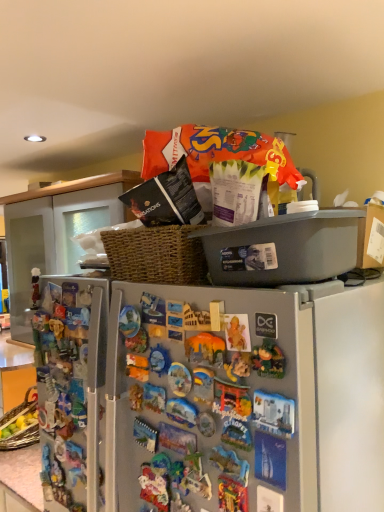
Identify the location of metallic gray refrigerator at center. The width and height of the screenshot is (384, 512). (245, 399).

This screenshot has height=512, width=384. I want to click on metallic gray refrigerator at center, so click(x=245, y=399).

From the image's perspective, would you say matte orange toy at center, which is the 2th toy in back-to-front order, is positioned over metallic gray refrigerator at center?

Yes.

Is matte orange toy at center, the 2th toy positioned from the left, facing away from metallic gray refrigerator at center?

Absolutely, matte orange toy at center, the 2th toy positioned from the left, is directed away from metallic gray refrigerator at center.

Considering the positions of objects matte orange toy at center, which is counted as the 1th toy, starting from the front, and metallic gray refrigerator at center in the image provided, who is more to the left, matte orange toy at center, which is counted as the 1th toy, starting from the front, or metallic gray refrigerator at center?

metallic gray refrigerator at center is more to the left.

Between matte orange toy at center, which is counted as the 1th toy, starting from the front, and matte plastic figurine at left, which is the 2th toy in front-to-back order, which one appears on the left side from the viewer's perspective?

From the viewer's perspective, matte plastic figurine at left, which is the 2th toy in front-to-back order, appears more on the left side.

How distant is matte orange toy at center, which is the 2th toy in back-to-front order, from matte plastic figurine at left, which is the 2th toy in front-to-back order?

29.35 inches.

From a real-world perspective, is matte orange toy at center, the 2th toy positioned from the left, physically below matte plastic figurine at left, the 1th toy when ordered from left to right?

Yes.

Does matte orange toy at center, the 2th toy positioned from the left, touch matte plastic figurine at left, the 1th toy when ordered from left to right?

No, matte orange toy at center, the 2th toy positioned from the left, is not with matte plastic figurine at left, the 1th toy when ordered from left to right.

Does metallic gray refrigerator at center turn towards matte orange toy at center, which is counted as the 1th toy, starting from the front?

Yes, metallic gray refrigerator at center is aimed at matte orange toy at center, which is counted as the 1th toy, starting from the front.

Which of these two, metallic gray refrigerator at center or matte orange toy at center, which is counted as the 1th toy, starting from the front, stands shorter?

matte orange toy at center, which is counted as the 1th toy, starting from the front.

Is matte orange toy at center, the 2th toy positioned from the left, completely or partially inside metallic gray refrigerator at center?

No, matte orange toy at center, the 2th toy positioned from the left, is not a part of metallic gray refrigerator at center.

How many degrees apart are the facing directions of metallic gray refrigerator at center and matte orange toy at center, the 2th toy positioned from the left?

metallic gray refrigerator at center and matte orange toy at center, the 2th toy positioned from the left, are facing 0.283 degrees away from each other.

How different are the orientations of metallic gray refrigerator at center and matte plastic figurine at left, the 1th toy when ordered from left to right, in degrees?

The angle between the facing direction of metallic gray refrigerator at center and the facing direction of matte plastic figurine at left, the 1th toy when ordered from left to right, is 1.97 degrees.

Considering the relative positions of metallic gray refrigerator at center and matte plastic figurine at left, the 1th toy when ordered from left to right, in the image provided, is metallic gray refrigerator at center to the left of matte plastic figurine at left, the 1th toy when ordered from left to right, from the viewer's perspective?

In fact, metallic gray refrigerator at center is to the right of matte plastic figurine at left, the 1th toy when ordered from left to right.

Considering the sizes of metallic gray refrigerator at center and matte plastic figurine at left, which is the 2th toy in front-to-back order, in the image, is metallic gray refrigerator at center wider or thinner than matte plastic figurine at left, which is the 2th toy in front-to-back order,?

In the image, metallic gray refrigerator at center appears to be wider than matte plastic figurine at left, which is the 2th toy in front-to-back order.

From the image's perspective, does metallic gray refrigerator at center appear higher than matte plastic figurine at left, arranged as the 2th toy when viewed from the right?

Actually, metallic gray refrigerator at center appears below matte plastic figurine at left, arranged as the 2th toy when viewed from the right, in the image.

In terms of height, does matte plastic figurine at left, arranged as the 2th toy when viewed from the right, look taller or shorter compared to metallic gray refrigerator at center?

matte plastic figurine at left, arranged as the 2th toy when viewed from the right, is shorter than metallic gray refrigerator at center.

Is point (33, 288) closer or farther from the camera than point (150, 379)?

Point (33, 288) is positioned farther from the camera compared to point (150, 379).

Considering the relative sizes of matte plastic figurine at left, arranged as the 2th toy when viewed from the right, and metallic gray refrigerator at center in the image provided, is matte plastic figurine at left, arranged as the 2th toy when viewed from the right, thinner than metallic gray refrigerator at center?

Yes, matte plastic figurine at left, arranged as the 2th toy when viewed from the right, is thinner than metallic gray refrigerator at center.

Can you confirm if matte plastic figurine at left, the 1th toy when ordered from left to right, is taller than matte orange toy at center, which is the 2th toy in back-to-front order?

Correct, matte plastic figurine at left, the 1th toy when ordered from left to right, is much taller as matte orange toy at center, which is the 2th toy in back-to-front order.

Considering their positions, is matte plastic figurine at left, positioned as the 1th toy in back-to-front order, located in front of or behind matte orange toy at center, which is the 2th toy in back-to-front order?

Visually, matte plastic figurine at left, positioned as the 1th toy in back-to-front order, is located behind matte orange toy at center, which is the 2th toy in back-to-front order.

Measure the distance from matte plastic figurine at left, which is the 2th toy in front-to-back order, to matte orange toy at center, positioned as the 1th toy in right-to-left order.

They are 29.35 inches apart.

Is matte plastic figurine at left, arranged as the 2th toy when viewed from the right, aimed at matte orange toy at center, the 2th toy positioned from the left?

No, matte plastic figurine at left, arranged as the 2th toy when viewed from the right, is not facing towards matte orange toy at center, the 2th toy positioned from the left.

You are a GUI agent. You are given a task and a screenshot of the screen. Output one action in this format:
    pyautogui.click(x=<x>, y=<y>)
    Task: Click on the toy that is the 1st one when counting upward from the metallic gray refrigerator at center (from the image's perspective)
    The height and width of the screenshot is (512, 384).
    Given the screenshot: What is the action you would take?
    pyautogui.click(x=236, y=334)

Identify the location of toy behind the matte orange toy at center, which is counted as the 1th toy, starting from the front. (35, 287).

Which object lies nearer to the anchor point matte orange toy at center, which is counted as the 1th toy, starting from the front, metallic gray refrigerator at center or matte plastic figurine at left, arranged as the 2th toy when viewed from the right?

metallic gray refrigerator at center.

From the image, which object appears to be farther from metallic gray refrigerator at center, matte plastic figurine at left, positioned as the 1th toy in back-to-front order, or matte orange toy at center, which is the 2th toy in back-to-front order?

The object further to metallic gray refrigerator at center is matte plastic figurine at left, positioned as the 1th toy in back-to-front order.

Estimate the real-world distances between objects in this image. Which object is further from matte orange toy at center, which is counted as the 1th toy, starting from the front, matte plastic figurine at left, arranged as the 2th toy when viewed from the right, or metallic gray refrigerator at center?

matte plastic figurine at left, arranged as the 2th toy when viewed from the right.

Considering their positions, is metallic gray refrigerator at center positioned further to matte plastic figurine at left, arranged as the 2th toy when viewed from the right, than matte orange toy at center, the 2th toy positioned from the left?

The object further to matte plastic figurine at left, arranged as the 2th toy when viewed from the right, is matte orange toy at center, the 2th toy positioned from the left.

From the image, which object appears to be nearer to matte plastic figurine at left, the 1th toy when ordered from left to right, matte orange toy at center, positioned as the 1th toy in right-to-left order, or metallic gray refrigerator at center?

Among the two, metallic gray refrigerator at center is located nearer to matte plastic figurine at left, the 1th toy when ordered from left to right.

From the image, which object appears to be farther from metallic gray refrigerator at center, matte orange toy at center, the 2th toy positioned from the left, or matte plastic figurine at left, the 1th toy when ordered from left to right?

matte plastic figurine at left, the 1th toy when ordered from left to right.

The height and width of the screenshot is (512, 384). Find the location of `toy between matte orange toy at center, positioned as the 1th toy in right-to-left order, and metallic gray refrigerator at center from front to back`. toy between matte orange toy at center, positioned as the 1th toy in right-to-left order, and metallic gray refrigerator at center from front to back is located at coordinates (35, 287).